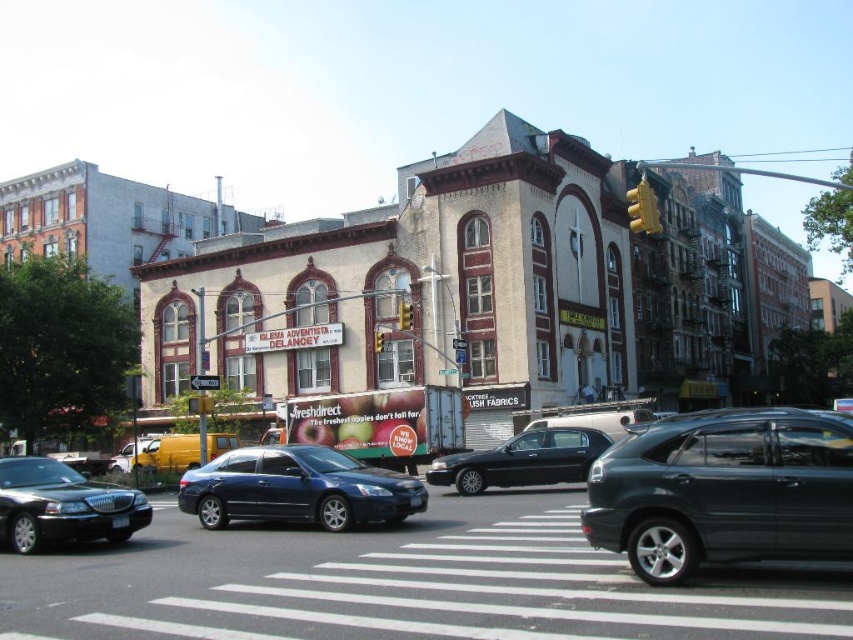
Is shiny black limousine at lower left closer to camera compared to yellow plastic traffic light at center?

Yes, shiny black limousine at lower left is in front of yellow plastic traffic light at center.

Can you confirm if shiny black limousine at lower left is bigger than yellow plastic traffic light at center?

Yes, shiny black limousine at lower left is bigger than yellow plastic traffic light at center.

Does point (22, 525) come in front of point (401, 314)?

Yes, point (22, 525) is closer to viewer.

Where is `shiny black limousine at lower left`? The image size is (853, 640). shiny black limousine at lower left is located at coordinates (62, 506).

Between glossy black suv at center right and shiny black sedan at center, which one is positioned higher?

Positioned higher is glossy black suv at center right.

Is glossy black suv at center right closer to the viewer compared to shiny black sedan at center?

Result: That is True.

You are a GUI agent. You are given a task and a screenshot of the screen. Output one action in this format:
    pyautogui.click(x=<x>, y=<y>)
    Task: Click on the glossy black suv at center right
    Image resolution: width=853 pixels, height=640 pixels.
    Given the screenshot: What is the action you would take?
    pyautogui.click(x=724, y=492)

Is matte blue sedan at center positioned in front of yellow matte traffic light at center?

That is True.

Does matte blue sedan at center appear over yellow matte traffic light at center?

Incorrect, matte blue sedan at center is not positioned above yellow matte traffic light at center.

Measure the distance between matte blue sedan at center and camera.

matte blue sedan at center and camera are 43.28 meters apart.

At what (x,y) coordinates should I click in order to perform the action: click on matte blue sedan at center. Please return your answer as a coordinate pair (x, y). This screenshot has height=640, width=853. Looking at the image, I should click on (297, 488).